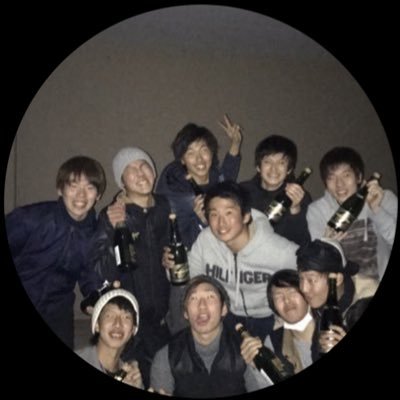
Locate an element on the screen. hood is located at coordinates (268, 231).